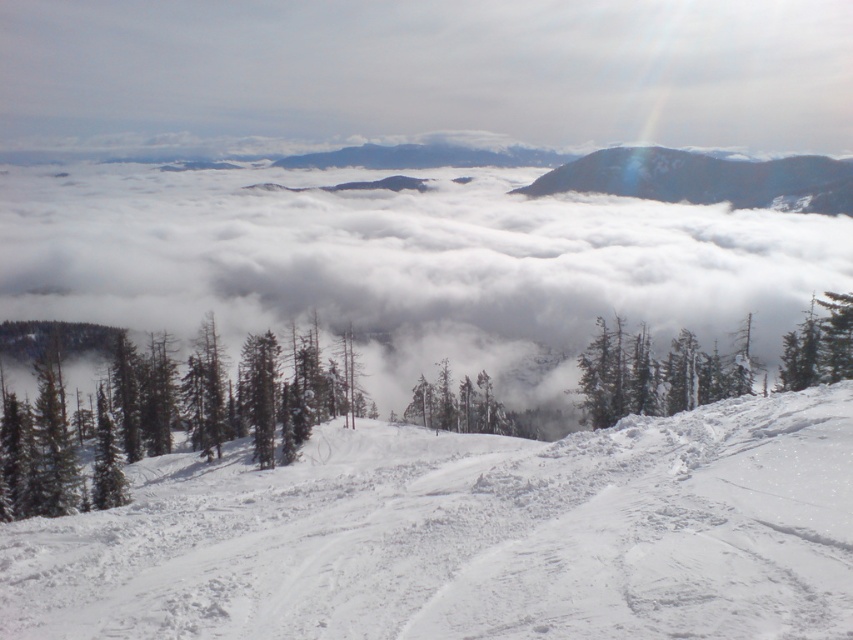
Is point (233, 170) positioned behind point (842, 342)?

Yes, it is.

Is white fluffy cloud at center to the left of green matte tree at upper right from the viewer's perspective?

Indeed, white fluffy cloud at center is positioned on the left side of green matte tree at upper right.

Who is more distant from viewer, (386,209) or (804,380)?

Point (386,209)

You are a GUI agent. You are given a task and a screenshot of the screen. Output one action in this format:
    pyautogui.click(x=<x>, y=<y>)
    Task: Click on the white fluffy cloud at center
    This screenshot has height=640, width=853.
    Given the screenshot: What is the action you would take?
    pyautogui.click(x=404, y=262)

Does white snow ski slope at center come behind green matte tree at upper right?

No, white snow ski slope at center is closer to the viewer.

Is white snow ski slope at center wider than green matte tree at upper right?

Yes.

Which is in front, point (601, 435) or point (798, 353)?

Positioned in front is point (601, 435).

Where is `white snow ski slope at center`? This screenshot has width=853, height=640. white snow ski slope at center is located at coordinates (469, 536).

Is white snow ski slope at center to the right of white fluffy cloud at center from the viewer's perspective?

Correct, you'll find white snow ski slope at center to the right of white fluffy cloud at center.

Which is above, white snow ski slope at center or white fluffy cloud at center?

Positioned higher is white fluffy cloud at center.

Is point (575, 449) positioned in front of point (210, 216)?

Yes, it is.

This screenshot has height=640, width=853. Find the location of `white snow ski slope at center`. white snow ski slope at center is located at coordinates (469, 536).